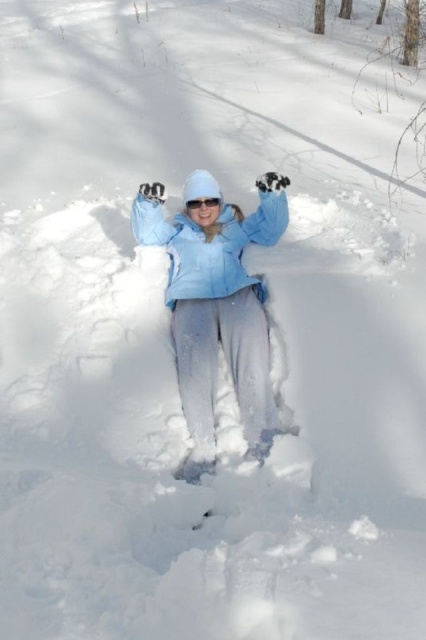
Can you confirm if light blue fabric at center is wider than matte blue jacket at center?

Incorrect, light blue fabric at center's width does not surpass matte blue jacket at center's.

Who is positioned more to the right, light blue fabric at center or matte blue jacket at center?

Positioned to the right is matte blue jacket at center.

Where is `light blue fabric at center`? This screenshot has height=640, width=426. light blue fabric at center is located at coordinates (216, 305).

Does light blue fabric at center appear over transparent plastic goggles at center?

Actually, light blue fabric at center is below transparent plastic goggles at center.

Does light blue fabric at center have a lesser height compared to transparent plastic goggles at center?

Incorrect, light blue fabric at center's height does not fall short of transparent plastic goggles at center's.

The height and width of the screenshot is (640, 426). Describe the element at coordinates (216, 305) in the screenshot. I see `light blue fabric at center` at that location.

Locate an element on the screen. Image resolution: width=426 pixels, height=640 pixels. light blue fabric at center is located at coordinates (216, 305).

Between matte blue jacket at center and transparent plastic goggles at center, which one is positioned higher?

transparent plastic goggles at center is above.

Is matte blue jacket at center to the left of transparent plastic goggles at center from the viewer's perspective?

Incorrect, matte blue jacket at center is not on the left side of transparent plastic goggles at center.

Is point (227, 285) positioned in front of point (213, 205)?

Yes, it is in front of point (213, 205).

Image resolution: width=426 pixels, height=640 pixels. Identify the location of matte blue jacket at center. (207, 244).